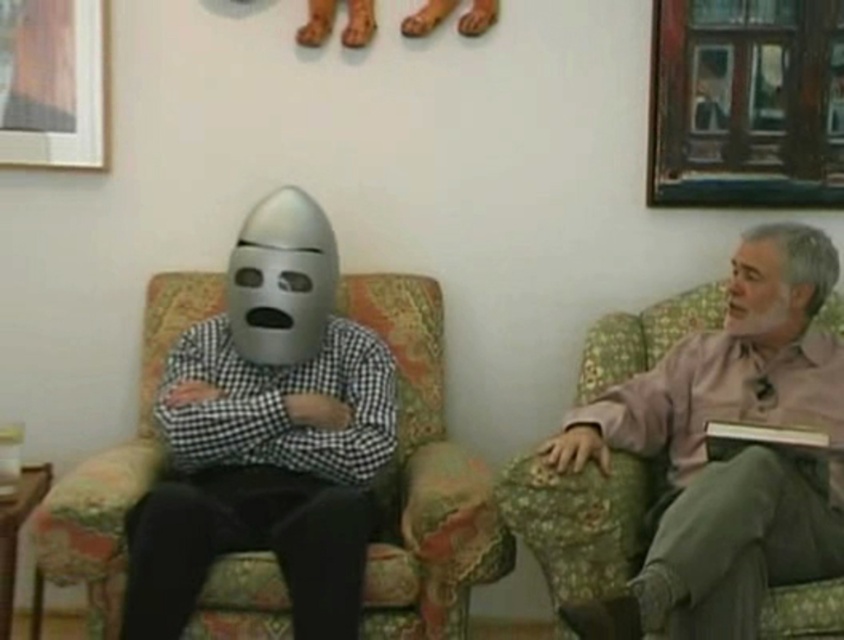
Which is more to the right, patterned fabric armchair at center or floral fabric armchair at right?

Positioned to the right is floral fabric armchair at right.

How far apart are patterned fabric armchair at center and floral fabric armchair at right?

patterned fabric armchair at center is 14.55 inches from floral fabric armchair at right.

The image size is (844, 640). Find the location of `patterned fabric armchair at center`. patterned fabric armchair at center is located at coordinates (423, 477).

Is wooden framed picture at upper right bigger than brushed metal picture frame at upper left?

Indeed, wooden framed picture at upper right has a larger size compared to brushed metal picture frame at upper left.

Does wooden framed picture at upper right have a smaller size compared to brushed metal picture frame at upper left?

Actually, wooden framed picture at upper right might be larger than brushed metal picture frame at upper left.

Between point (823, 198) and point (7, 104), which one is positioned behind?

The point (823, 198) is more distant.

Locate an element on the screen. This screenshot has height=640, width=844. wooden framed picture at upper right is located at coordinates (745, 104).

Can you confirm if patterned fabric armchair at center is shorter than brushed metal picture frame at upper left?

In fact, patterned fabric armchair at center may be taller than brushed metal picture frame at upper left.

Who is taller, patterned fabric armchair at center or brushed metal picture frame at upper left?

With more height is patterned fabric armchair at center.

Is point (257, 561) more distant than point (4, 81)?

No, (257, 561) is closer to viewer.

Identify the location of patterned fabric armchair at center. This screenshot has width=844, height=640. 423,477.